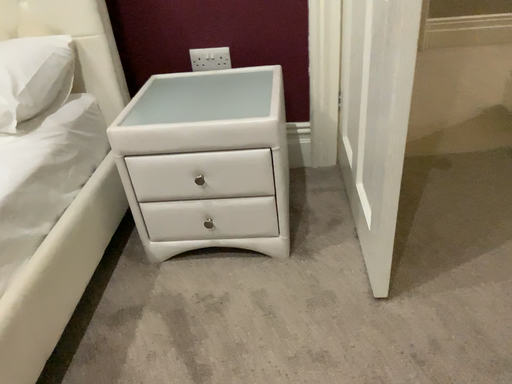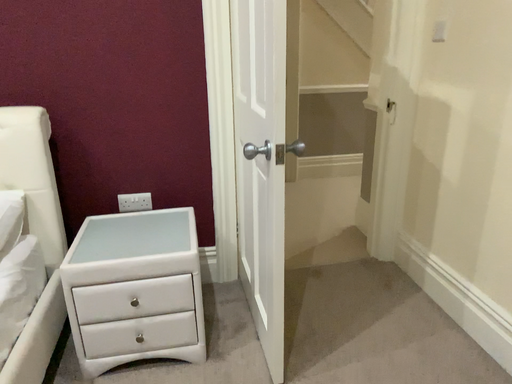
Question: Which way did the camera rotate in the video?

Choices:
 (A) rotated left
 (B) rotated right

Answer: (B)